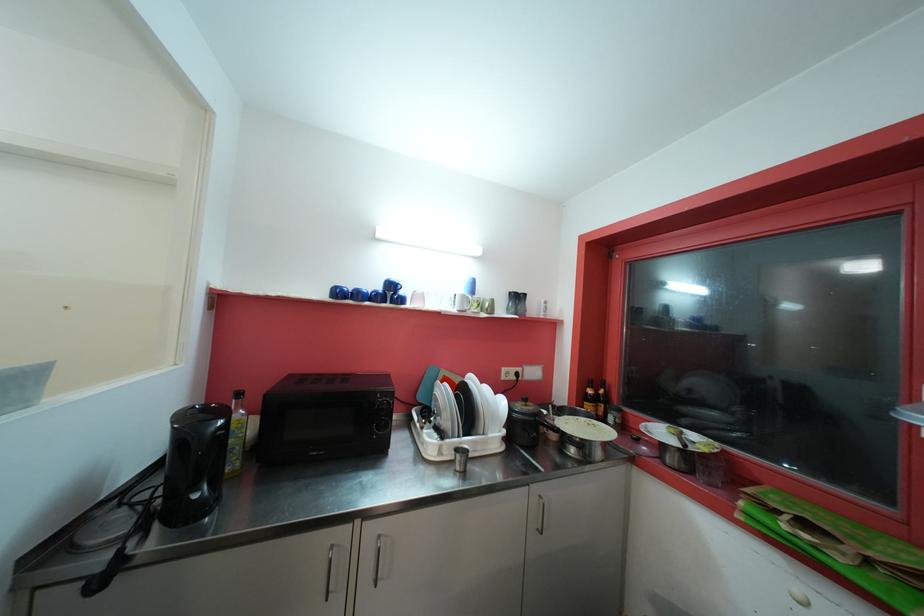
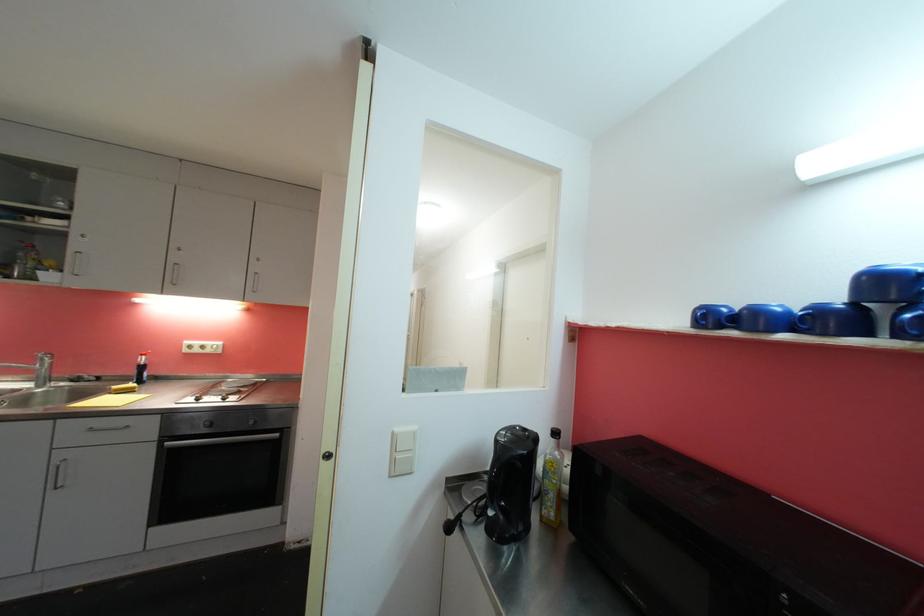
Question: The first image is from the beginning of the video and the second image is from the end. How did the camera likely rotate when shooting the video?

Choices:
 (A) Left
 (B) Right
 (C) Up
 (D) Down

Answer: (A)